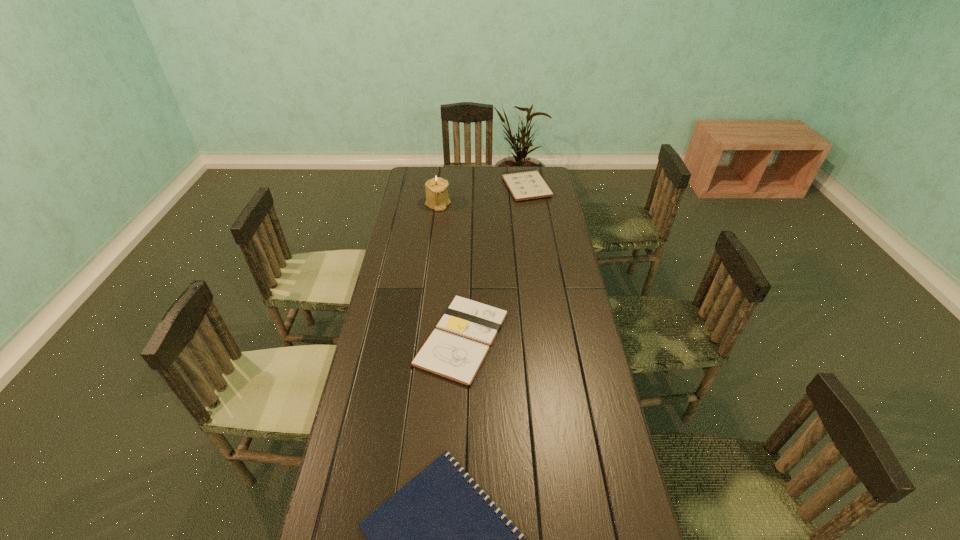
I want to click on the tallest object, so click(437, 198).

Find the location of a particular element. This screenshot has height=540, width=960. the third shortest object is located at coordinates (527, 185).

Identify the location of the farthest notepad. (527, 185).

Find the location of a particular element. the third tallest object is located at coordinates [x=456, y=349].

You are a GUI agent. You are given a task and a screenshot of the screen. Output one action in this format:
    pyautogui.click(x=<x>, y=<y>)
    Task: Click on the second shortest notepad
    The width and height of the screenshot is (960, 540).
    Given the screenshot: What is the action you would take?
    pyautogui.click(x=456, y=349)

Locate an element on the screen. The width and height of the screenshot is (960, 540). free space located on the front of the tallest object is located at coordinates (433, 245).

Locate an element on the screen. The image size is (960, 540). free space located on the left of the farthest notepad is located at coordinates (481, 187).

You are a GUI agent. You are given a task and a screenshot of the screen. Output one action in this format:
    pyautogui.click(x=<x>, y=<y>)
    Task: Click on the free space located 0.150m on the back of the second shortest notepad
    This screenshot has height=540, width=960.
    Given the screenshot: What is the action you would take?
    pyautogui.click(x=465, y=272)

This screenshot has width=960, height=540. What are the coordinates of `object situated at the far edge` in the screenshot? It's located at (527, 185).

Locate an element on the screen. Image resolution: width=960 pixels, height=540 pixels. candle_holder at the left edge is located at coordinates (437, 198).